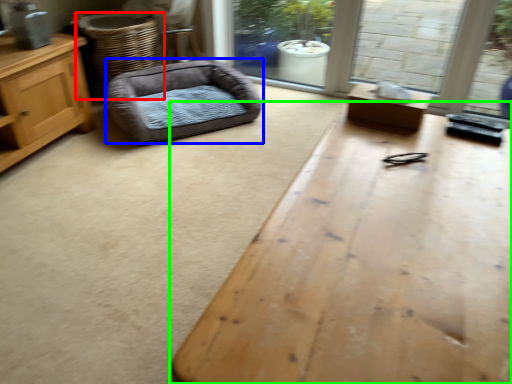
Question: Which object is the farthest from basket (highlighted by a red box)? Choose among these: dog bed (highlighted by a blue box) or table (highlighted by a green box).

Choices:
 (A) dog bed
 (B) table

Answer: (B)